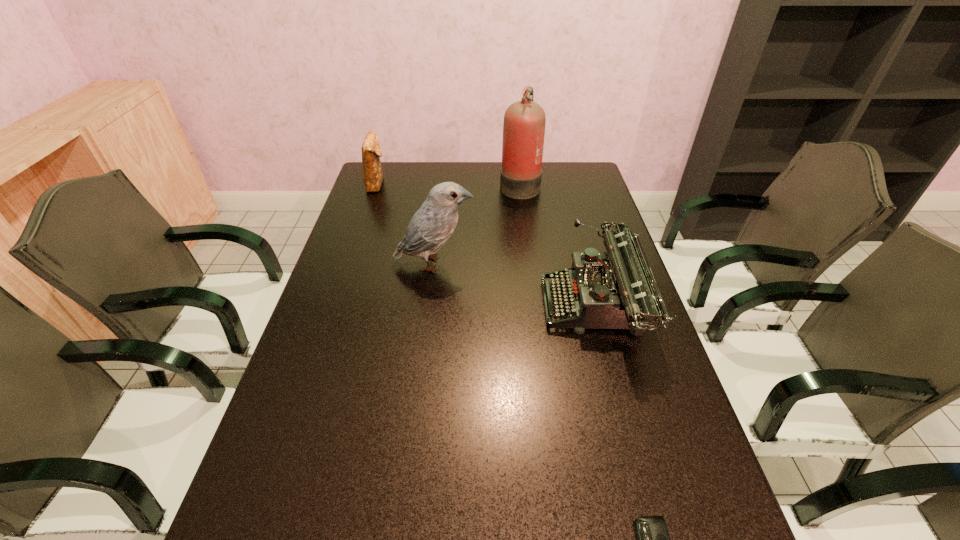
The width and height of the screenshot is (960, 540). What are the coordinates of `the tallest object` in the screenshot? It's located at (524, 123).

I want to click on the second tallest object, so click(x=431, y=226).

Locate an element on the screen. The height and width of the screenshot is (540, 960). the second object from left to right is located at coordinates 431,226.

The image size is (960, 540). Identify the location of clutch bag. (371, 150).

Where is `typewriter`? The width and height of the screenshot is (960, 540). typewriter is located at coordinates (x=620, y=293).

In order to click on free region located at the nozzle of the tallest object in this screenshot , I will do `click(446, 184)`.

Where is `free space located 0.170m at the nozzle of the tallest object`? The image size is (960, 540). free space located 0.170m at the nozzle of the tallest object is located at coordinates (454, 184).

Where is `vacant point located 0.350m at the nozzle of the tallest object`? This screenshot has height=540, width=960. vacant point located 0.350m at the nozzle of the tallest object is located at coordinates (407, 184).

Identify the location of free location located on the front-facing side of the second tallest object. Image resolution: width=960 pixels, height=540 pixels. (558, 264).

Identify the location of vacant space located 0.380m on the open side of the leftmost object. (487, 183).